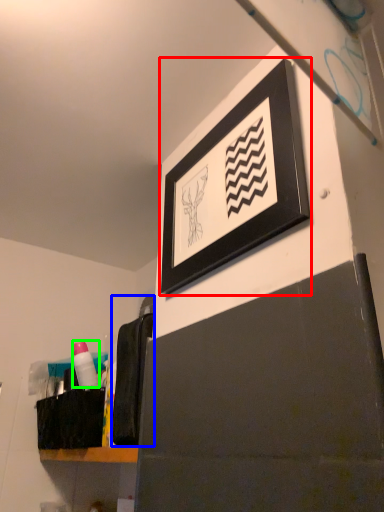
Question: Based on their relative distances, which object is nearer to picture frame (highlighted by a red box)? Choose from laundry (highlighted by a blue box) and toiletry (highlighted by a green box).

Choices:
 (A) laundry
 (B) toiletry

Answer: (A)